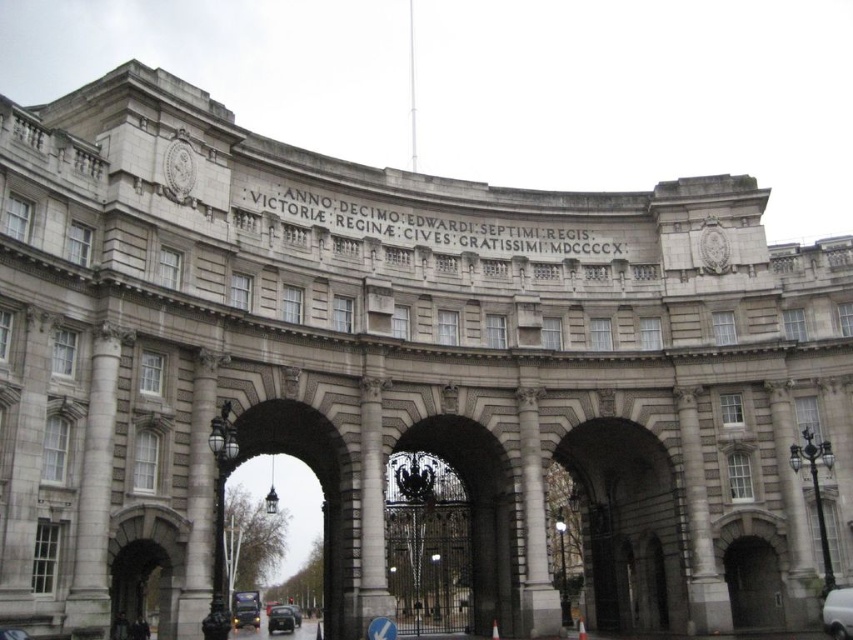
The width and height of the screenshot is (853, 640). I want to click on polished metal gate at center, so click(x=453, y=532).

Is polished metal gate at center to the left of polished stone archway at center from the viewer's perspective?

No, polished metal gate at center is not to the left of polished stone archway at center.

Who is more distant from viewer, (514, 545) or (223, 577)?

Positioned behind is point (223, 577).

This screenshot has width=853, height=640. Identify the location of polished metal gate at center. (453, 532).

Between gray stone archway at center and white marble pillar at center, which one is positioned higher?

white marble pillar at center

Is gray stone archway at center wider than white marble pillar at center?

Correct, the width of gray stone archway at center exceeds that of white marble pillar at center.

The height and width of the screenshot is (640, 853). What do you see at coordinates (627, 525) in the screenshot?
I see `gray stone archway at center` at bounding box center [627, 525].

Locate an element on the screen. This screenshot has width=853, height=640. gray stone archway at center is located at coordinates (627, 525).

How distant is polished metal gate at center from black glossy car at center?

They are 26.86 meters apart.

Which is behind, point (421, 604) or point (292, 616)?

Point (292, 616)

Locate an element on the screen. The width and height of the screenshot is (853, 640). polished metal gate at center is located at coordinates (453, 532).